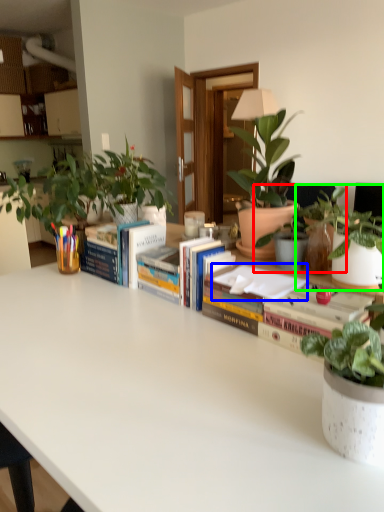
Question: Based on their relative distances, which object is nearer to houseplant (highlighted by a red box)? Choose from paperback book (highlighted by a blue box) and houseplant (highlighted by a green box).

Choices:
 (A) paperback book
 (B) houseplant

Answer: (B)